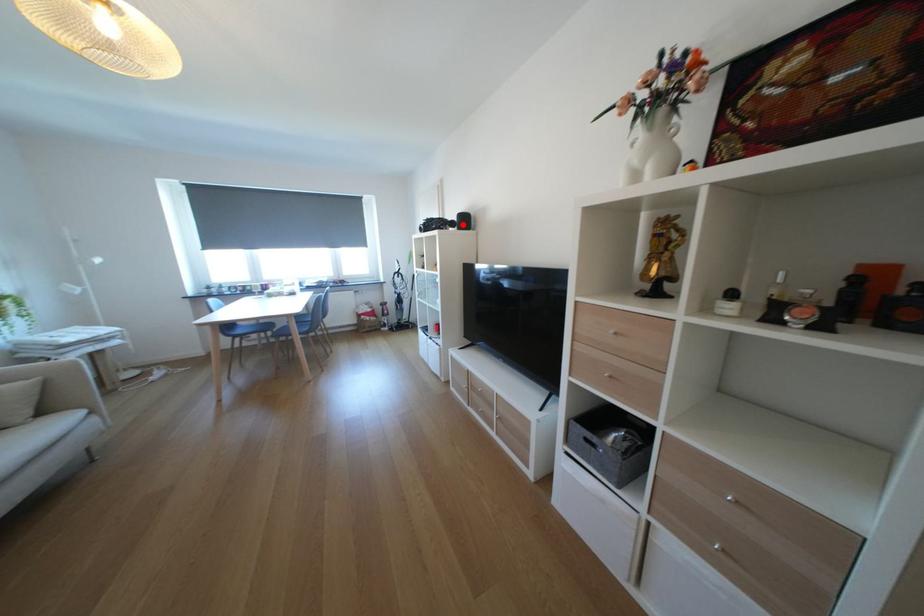
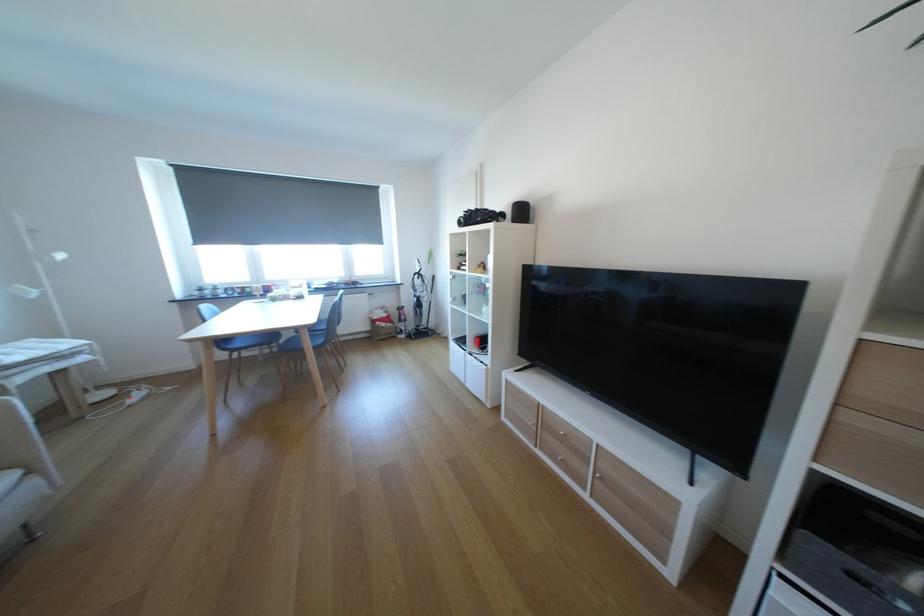
Find the pixel in the second image that matches the highlighted location in the first image.

(514, 217)